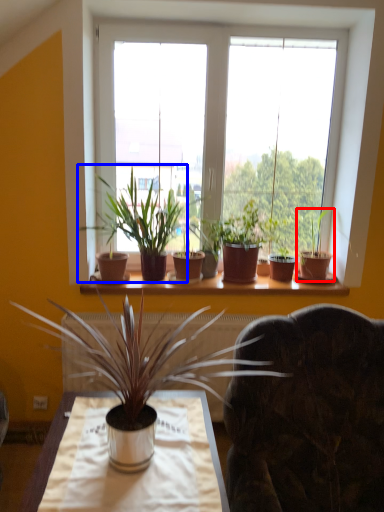
Question: Which point is closer to the camera, houseplant (highlighted by a red box) or houseplant (highlighted by a blue box)?

Choices:
 (A) houseplant
 (B) houseplant

Answer: (B)